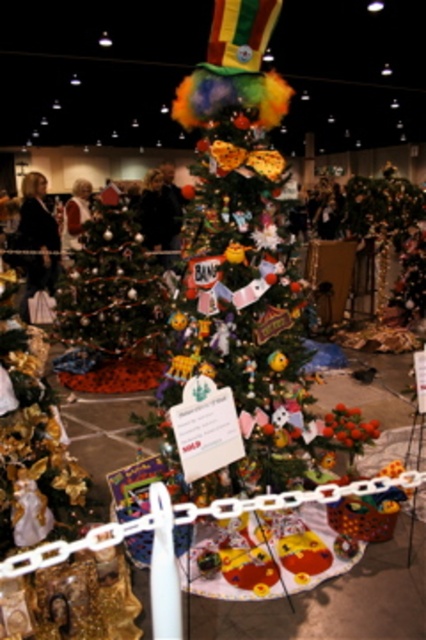
Question: Which is nearer to the green matte christmas tree at left?

Choices:
 (A) matte gold jacket at center
 (B) black fabric at left

Answer: (B)

Question: Where is green matte christmas tree at left located in relation to matte gold jacket at center in the image?

Choices:
 (A) left
 (B) right

Answer: (B)

Question: Can you confirm if black fabric at left is smaller than matte gold jacket at center?

Choices:
 (A) yes
 (B) no

Answer: (B)

Question: Can you confirm if green matte christmas tree at left is positioned below black fabric at left?

Choices:
 (A) yes
 (B) no

Answer: (A)

Question: Which object is the farthest from the black fabric at left?

Choices:
 (A) matte gold jacket at center
 (B) green matte christmas tree at left

Answer: (B)

Question: Among these objects, which one is farthest from the camera?

Choices:
 (A) black fabric at left
 (B) matte gold jacket at center

Answer: (B)